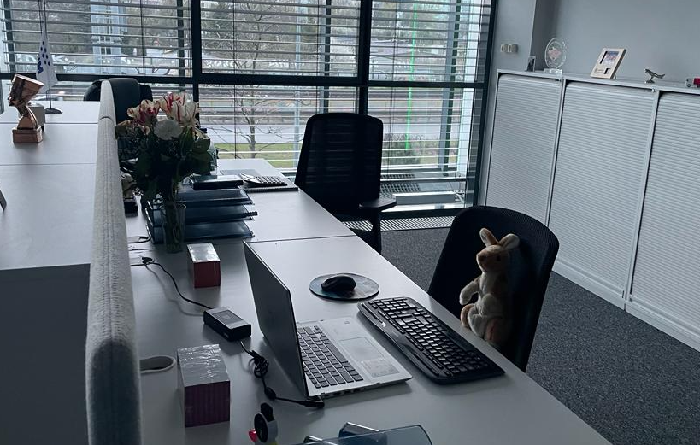
This screenshot has height=445, width=700. Identify the location of 1 stuffed animal. (484, 309).